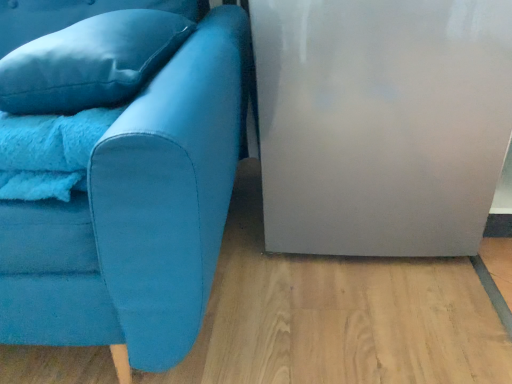
Question: Is matte blue couch at left facing away from satin blue pillow at upper left?

Choices:
 (A) yes
 (B) no

Answer: (B)

Question: From the image's perspective, is matte blue couch at left above satin blue pillow at upper left?

Choices:
 (A) yes
 (B) no

Answer: (B)

Question: Is matte blue couch at left positioned far away from satin blue pillow at upper left?

Choices:
 (A) yes
 (B) no

Answer: (B)

Question: From the image's perspective, is matte blue couch at left beneath satin blue pillow at upper left?

Choices:
 (A) yes
 (B) no

Answer: (A)

Question: From a real-world perspective, does matte blue couch at left stand above satin blue pillow at upper left?

Choices:
 (A) yes
 (B) no

Answer: (B)

Question: Is matte blue couch at left at the right side of satin blue pillow at upper left?

Choices:
 (A) no
 (B) yes

Answer: (A)

Question: Can you confirm if satin blue pillow at upper left is positioned to the right of matte blue couch at left?

Choices:
 (A) yes
 (B) no

Answer: (A)

Question: Considering the relative positions of satin blue pillow at upper left and matte blue couch at left in the image provided, is satin blue pillow at upper left in front of matte blue couch at left?

Choices:
 (A) no
 (B) yes

Answer: (A)

Question: Is satin blue pillow at upper left taller than matte blue couch at left?

Choices:
 (A) no
 (B) yes

Answer: (A)

Question: Does satin blue pillow at upper left turn towards matte blue couch at left?

Choices:
 (A) yes
 (B) no

Answer: (A)

Question: Considering the relative sizes of satin blue pillow at upper left and matte blue couch at left in the image provided, is satin blue pillow at upper left thinner than matte blue couch at left?

Choices:
 (A) yes
 (B) no

Answer: (A)

Question: Considering the relative sizes of satin blue pillow at upper left and matte blue couch at left in the image provided, is satin blue pillow at upper left bigger than matte blue couch at left?

Choices:
 (A) no
 (B) yes

Answer: (A)

Question: From the image's perspective, is matte blue couch at left positioned above or below satin blue pillow at upper left?

Choices:
 (A) below
 (B) above

Answer: (A)